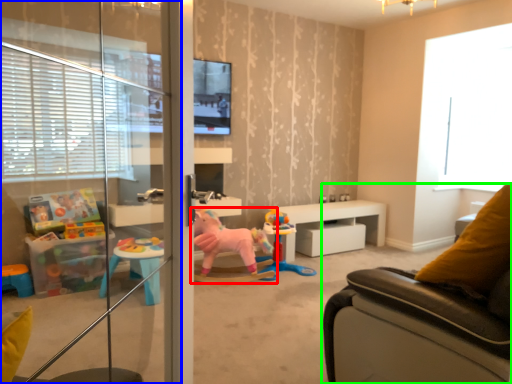
Question: Considering the real-world distances, which object is farthest from toy (highlighted by a red box)? screen door (highlighted by a blue box) or studio couch (highlighted by a green box)?

Choices:
 (A) screen door
 (B) studio couch

Answer: (B)